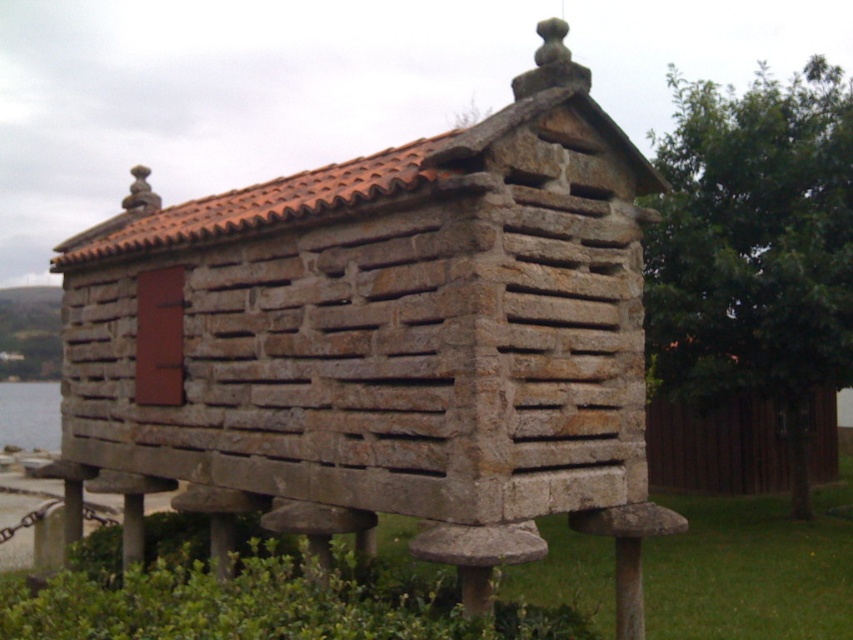
Question: Does natural stone hut at center appear under clear water at lower left?

Choices:
 (A) no
 (B) yes

Answer: (A)

Question: Which of the following is the closest to the observer?

Choices:
 (A) natural stone hut at center
 (B) green grass at lower center

Answer: (B)

Question: Can you confirm if green grass at lower center is positioned to the right of clear water at lower left?

Choices:
 (A) yes
 (B) no

Answer: (A)

Question: Considering the relative positions of green grass at lower center and clear water at lower left in the image provided, where is green grass at lower center located with respect to clear water at lower left?

Choices:
 (A) below
 (B) above

Answer: (A)

Question: Considering the real-world distances, which object is closest to the green grass at lower center?

Choices:
 (A) natural stone hut at center
 (B) clear water at lower left

Answer: (A)

Question: Which point is farther to the camera?

Choices:
 (A) clear water at lower left
 (B) green grass at lower center
 (C) natural stone hut at center

Answer: (A)